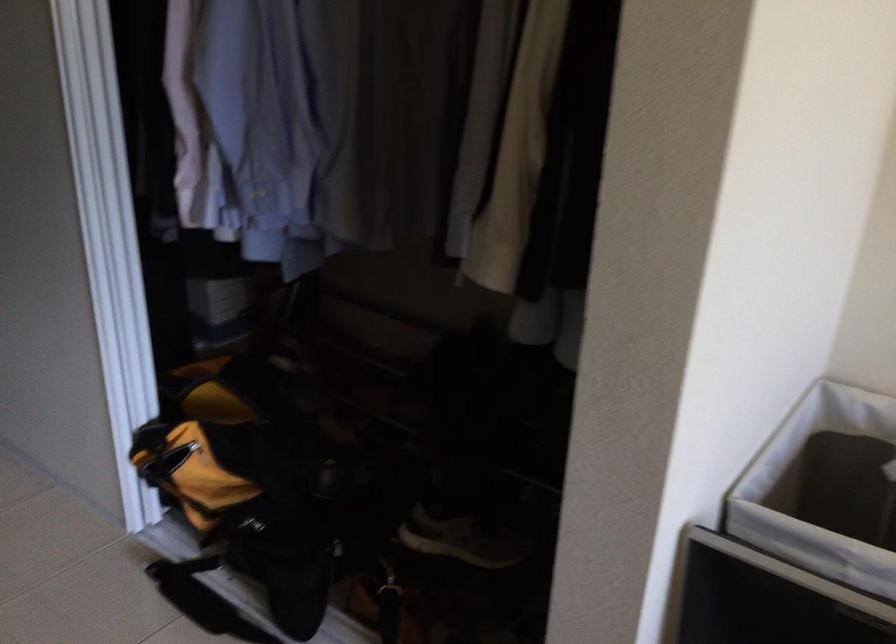
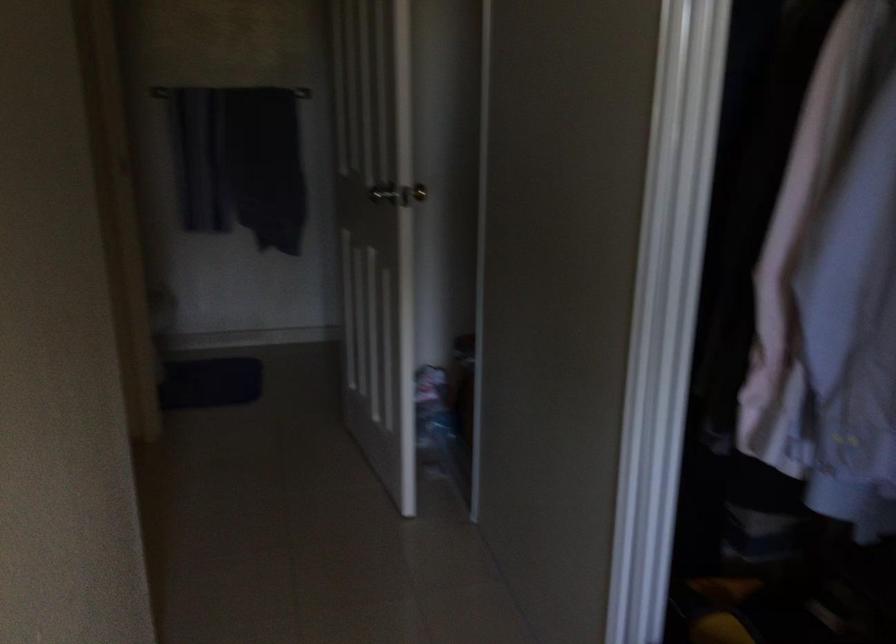
Question: The camera is either moving clockwise (left) or counter-clockwise (right) around the object. The first image is from the beginning of the video and the second image is from the end. Is the camera moving left or right when shooting the video?

Choices:
 (A) Left
 (B) Right

Answer: (B)